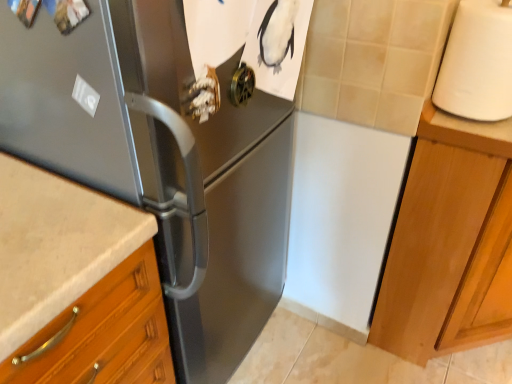
Question: Considering the relative sizes of white matte countertop at right and light wood cabinet at right in the image provided, is white matte countertop at right shorter than light wood cabinet at right?

Choices:
 (A) no
 (B) yes

Answer: (B)

Question: Is white matte countertop at right in contact with light wood cabinet at right?

Choices:
 (A) yes
 (B) no

Answer: (B)

Question: From the image's perspective, does white matte countertop at right appear higher than light wood cabinet at right?

Choices:
 (A) yes
 (B) no

Answer: (A)

Question: Could you tell me if white matte countertop at right is turned towards light wood cabinet at right?

Choices:
 (A) yes
 (B) no

Answer: (B)

Question: From a real-world perspective, is white matte countertop at right on light wood cabinet at right?

Choices:
 (A) yes
 (B) no

Answer: (A)

Question: Considering the relative sizes of white matte countertop at right and light wood cabinet at right in the image provided, is white matte countertop at right thinner than light wood cabinet at right?

Choices:
 (A) no
 (B) yes

Answer: (B)

Question: Are light wood cabinet at right and white matte paper towel at right making contact?

Choices:
 (A) no
 (B) yes

Answer: (A)

Question: Is light wood cabinet at right positioned far away from white matte paper towel at right?

Choices:
 (A) yes
 (B) no

Answer: (B)

Question: From a real-world perspective, is light wood cabinet at right positioned over white matte paper towel at right based on gravity?

Choices:
 (A) no
 (B) yes

Answer: (A)

Question: Can you confirm if light wood cabinet at right is smaller than white matte paper towel at right?

Choices:
 (A) yes
 (B) no

Answer: (B)

Question: Does light wood cabinet at right come behind white matte paper towel at right?

Choices:
 (A) yes
 (B) no

Answer: (A)

Question: From the image's perspective, is light wood cabinet at right on top of white matte paper towel at right?

Choices:
 (A) no
 (B) yes

Answer: (A)

Question: From a real-world perspective, is satin black refrigerator at left physically above light wood cabinet at right?

Choices:
 (A) yes
 (B) no

Answer: (A)